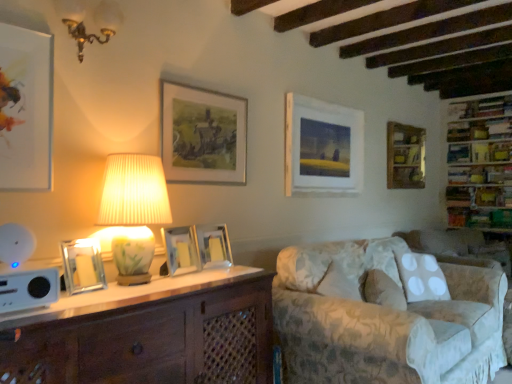
Image resolution: width=512 pixels, height=384 pixels. I want to click on vacant space to the right of silver metallic picture frame at center, the 4th picture frame when ordered from front to back, so click(x=241, y=269).